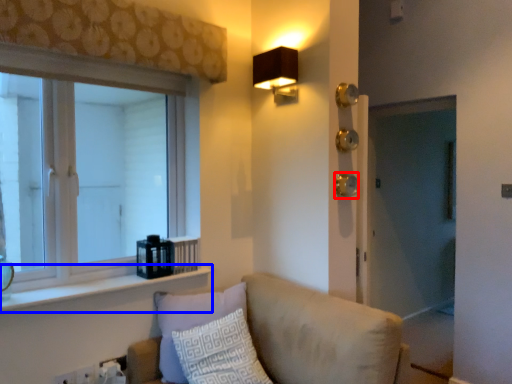
Question: Which object appears closest to the camera in this image, door handle (highlighted by a red box) or window sill (highlighted by a blue box)?

Choices:
 (A) door handle
 (B) window sill

Answer: (B)